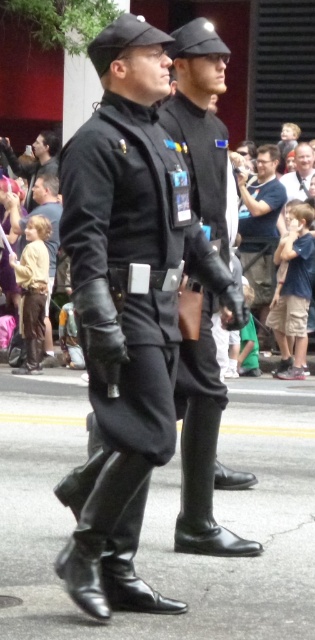
Is matte black uniform at center to the left of shiny black boots at center from the viewer's perspective?

Indeed, matte black uniform at center is positioned on the left side of shiny black boots at center.

The height and width of the screenshot is (640, 315). Identify the location of matte black uniform at center. coord(127,308).

Is shiny black boots at center smaller than matte black shirt at center?

Yes, shiny black boots at center is smaller than matte black shirt at center.

Measure the distance between point (216, 416) and camera.

A: Point (216, 416) is 4.83 meters away from camera.

At what (x,y) coordinates should I click in order to perform the action: click on shiny black boots at center. Please return your answer as a coordinate pair (x, y). Image resolution: width=315 pixels, height=640 pixels. Looking at the image, I should click on (201, 124).

Is matte black shirt at center to the right of brown leather pants at lower left from the viewer's perspective?

Yes, matte black shirt at center is to the right of brown leather pants at lower left.

Who is shorter, matte black shirt at center or brown leather pants at lower left?

Standing shorter between the two is matte black shirt at center.

This screenshot has width=315, height=640. Describe the element at coordinates (259, 224) in the screenshot. I see `matte black shirt at center` at that location.

At what (x,y) coordinates should I click in order to perform the action: click on matte black shirt at center. Please return your answer as a coordinate pair (x, y). Image resolution: width=315 pixels, height=640 pixels. Looking at the image, I should click on (259, 224).